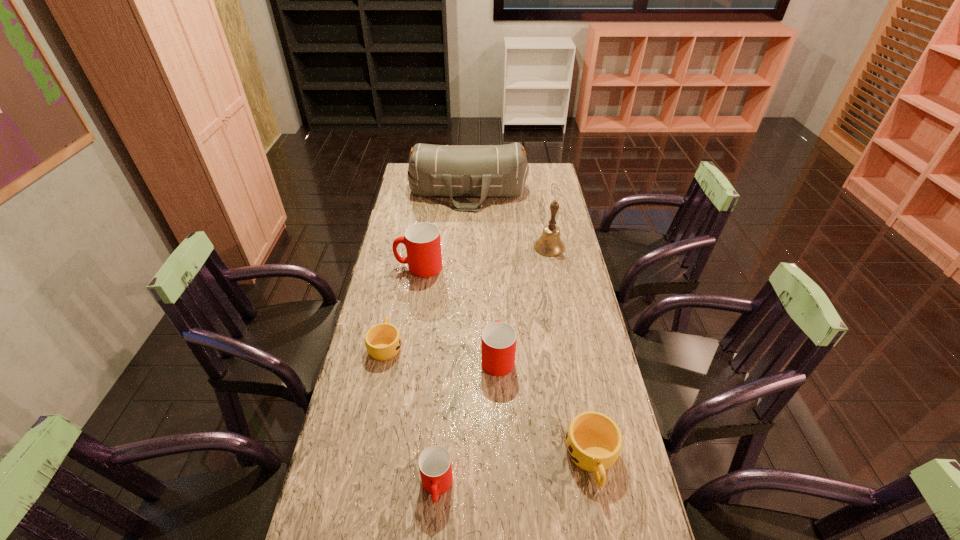
At what (x,y) coordinates should I click in order to perform the action: click on vacant point located between the rightmost red cup and the shortest object. Please return your answer as a coordinate pair (x, y). Looking at the image, I should click on (442, 351).

I want to click on free space between the tallest cup and the duffel bag, so click(444, 230).

Where is `free space between the bell and the shortest object`? The image size is (960, 540). free space between the bell and the shortest object is located at coordinates (468, 296).

Locate an element on the screen. The image size is (960, 540). free spot between the bell and the second shortest object is located at coordinates (570, 353).

The height and width of the screenshot is (540, 960). In order to click on free space between the second cup from right to left and the leftmost red cup in this screenshot , I will do `click(458, 312)`.

You are a GUI agent. You are given a task and a screenshot of the screen. Output one action in this format:
    pyautogui.click(x=<x>, y=<y>)
    Task: Click on the vacant area that lies between the smallest red cup and the fourth tallest object
    This screenshot has height=540, width=960.
    Given the screenshot: What is the action you would take?
    pyautogui.click(x=468, y=422)

Locate an element on the screen. This screenshot has width=960, height=540. object that is the second closest to the duffel bag is located at coordinates (422, 240).

The width and height of the screenshot is (960, 540). Identify the location of object that is the third closest to the fourth tallest cup. (383, 341).

The width and height of the screenshot is (960, 540). In order to click on cup that stands as the closest to the third shortest cup in this screenshot , I will do `click(498, 339)`.

This screenshot has height=540, width=960. Find the location of `the second closest cup to the third shortest cup`. the second closest cup to the third shortest cup is located at coordinates (593, 440).